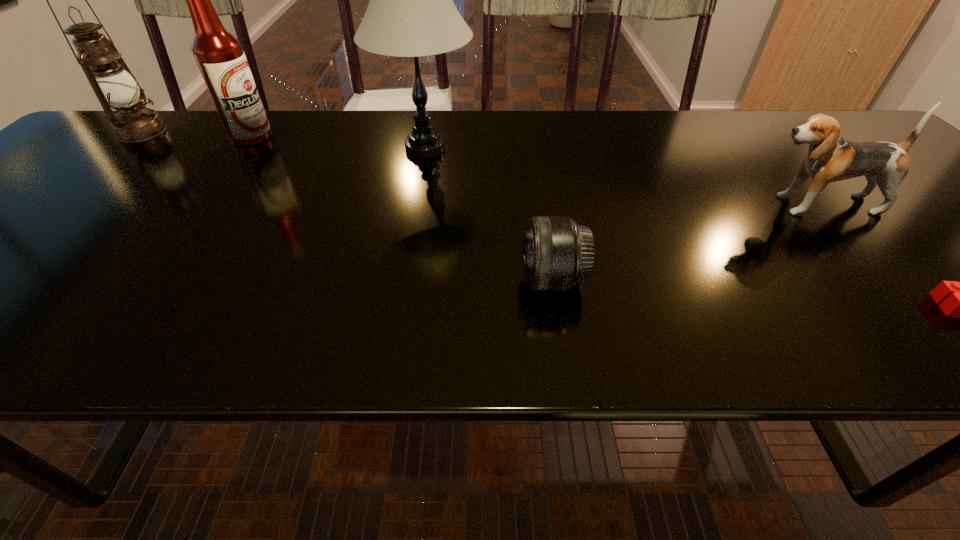
Find the location of a particular element. The height and width of the screenshot is (540, 960). vacant space that is in between the third object from left to right and the puppy is located at coordinates (620, 177).

Identify the location of object that can be found as the third closest to the fifth object from right to left. This screenshot has height=540, width=960. click(x=557, y=253).

What are the coordinates of `object that is the closest to the third shortest object` in the screenshot? It's located at (959, 302).

This screenshot has width=960, height=540. Identify the location of vacant area that satisfies the following two spatial constraints: 1. on the label side of the alcohol; 2. on the right side of the lamp. (244, 148).